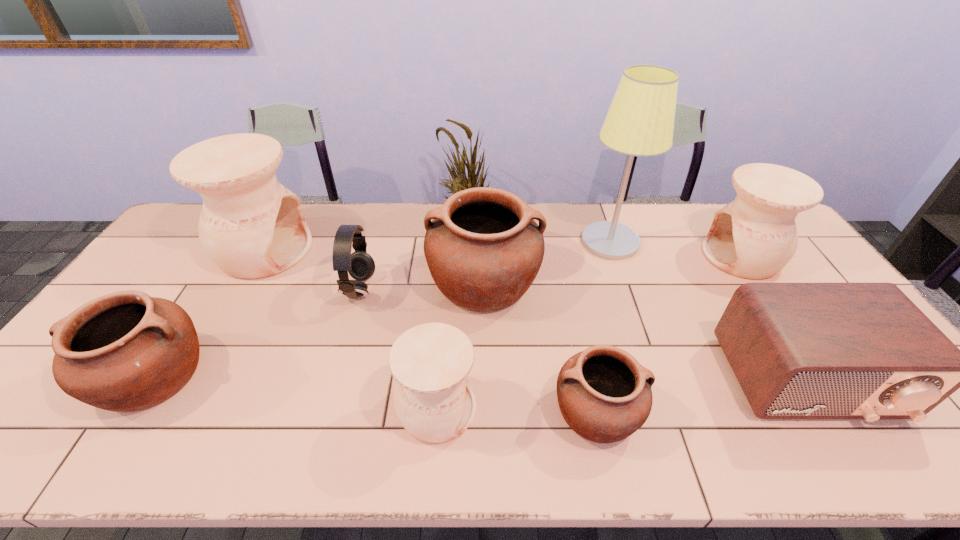
Locate an element on the screen. The height and width of the screenshot is (540, 960). the tallest object is located at coordinates (640, 122).

Locate an element on the screen. Image resolution: width=960 pixels, height=540 pixels. the tallest pottery is located at coordinates (251, 226).

Locate an element on the screen. Image resolution: width=960 pixels, height=540 pixels. the second tallest object is located at coordinates (251, 226).

At what (x,y) coordinates should I click in order to perform the action: click on the rightmost pottery. Please return your answer as a coordinate pair (x, y). The width and height of the screenshot is (960, 540). Looking at the image, I should click on (755, 236).

Find the location of a particular element. The height and width of the screenshot is (540, 960). the second biggest cream pottery is located at coordinates (755, 236).

The height and width of the screenshot is (540, 960). What are the coordinates of `the farthest reddish pottery` in the screenshot? It's located at (483, 249).

You are a GUI agent. You are given a task and a screenshot of the screen. Output one action in this format:
    pyautogui.click(x=<x>, y=<y>)
    Task: Click on the black earphone
    This screenshot has width=960, height=540.
    Given the screenshot: What is the action you would take?
    pyautogui.click(x=360, y=265)

At what (x,y) coordinates should I click in order to perform the action: click on the seventh object from right to left. Please return your answer as a coordinate pair (x, y). The height and width of the screenshot is (540, 960). Looking at the image, I should click on (360, 265).

Locate an element on the screen. The height and width of the screenshot is (540, 960). the leftmost reddish pottery is located at coordinates (125, 351).

Locate an element on the screen. The image size is (960, 540). radio receiver is located at coordinates (865, 351).